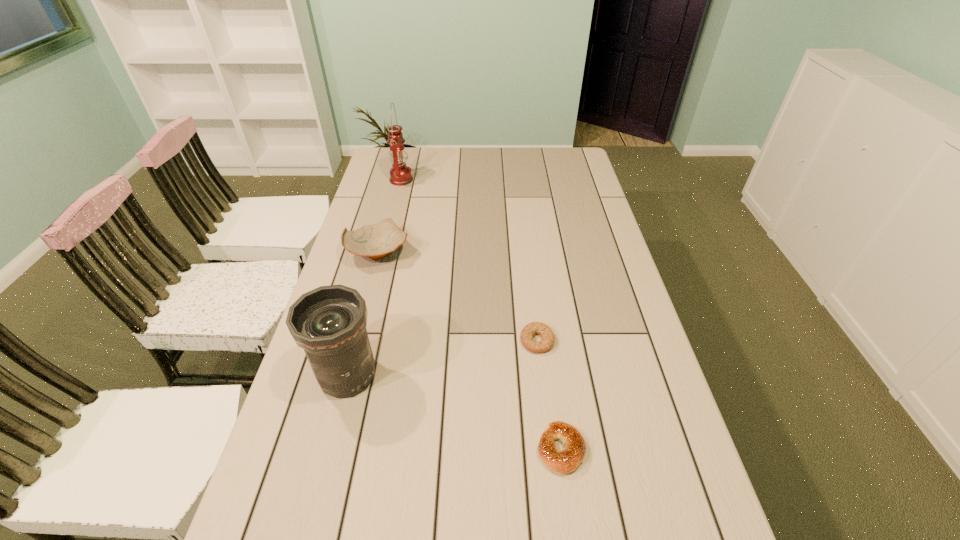
You are a GUI agent. You are given a task and a screenshot of the screen. Output one action in this format:
    pyautogui.click(x=<x>, y=<y>)
    Task: Click on the vacant space located 0.110m on the left of the nearer bagel
    
    Given the screenshot: What is the action you would take?
    pyautogui.click(x=487, y=449)

At what (x,y) coordinates should I click in order to perform the action: click on vacant region located on the front of the farther bagel. Please return your answer as a coordinate pair (x, y). Looking at the image, I should click on (552, 465).

I want to click on object present at the far edge, so click(x=400, y=174).

Find the location of `oil lamp situated at the left edge`. oil lamp situated at the left edge is located at coordinates (400, 174).

Where is `telephoto lens that is positioned at the left edge`? This screenshot has height=540, width=960. telephoto lens that is positioned at the left edge is located at coordinates (329, 322).

At what (x,y) coordinates should I click in order to perform the action: click on pottery located at the left edge. Please return your answer as a coordinate pair (x, y). Looking at the image, I should click on (376, 241).

Find the location of a particular element. This screenshot has width=960, height=540. object present at the far left corner is located at coordinates 400,174.

In the image, there is a desktop. Where is `vacant space at the left edge`? vacant space at the left edge is located at coordinates (366, 217).

Where is `blank space at the right edge of the desktop`? blank space at the right edge of the desktop is located at coordinates (598, 347).

Where is `vacant space at the far right corner of the desktop`? vacant space at the far right corner of the desktop is located at coordinates (564, 160).